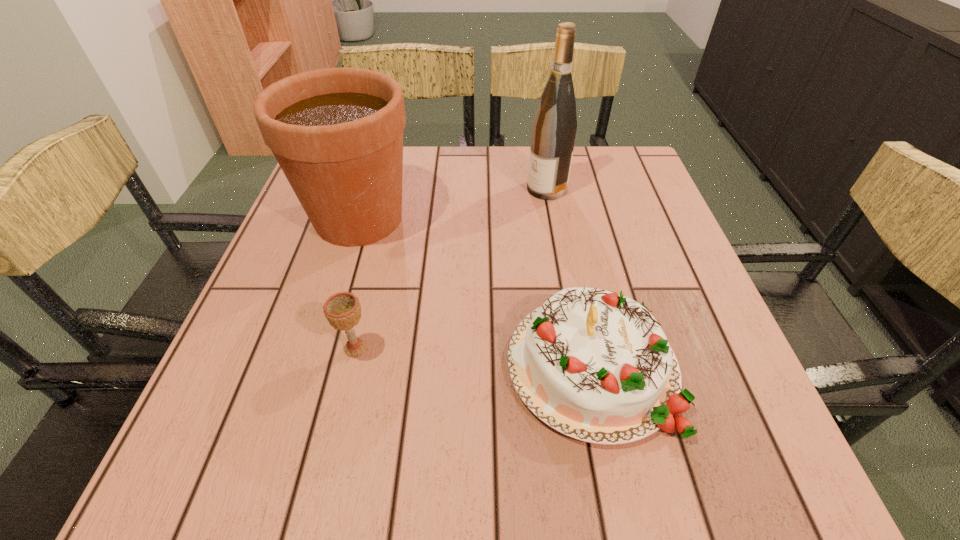
Image resolution: width=960 pixels, height=540 pixels. I want to click on object located in the near edge section of the desktop, so click(x=595, y=365).

The image size is (960, 540). What are the coordinates of `object that is at the left edge` in the screenshot? It's located at (337, 133).

The height and width of the screenshot is (540, 960). Find the location of `object that is at the right edge`. object that is at the right edge is located at coordinates (595, 365).

The image size is (960, 540). In order to click on object that is positioned at the far left corner in this screenshot , I will do `click(337, 133)`.

Image resolution: width=960 pixels, height=540 pixels. What are the coordinates of `object located in the near right corner section of the desktop` in the screenshot? It's located at (595, 365).

Where is `vacant space at the far edge of the desktop`? Image resolution: width=960 pixels, height=540 pixels. vacant space at the far edge of the desktop is located at coordinates (413, 159).

In the image, there is a desktop. Where is `vacant space at the near edge`? vacant space at the near edge is located at coordinates (348, 437).

In the image, there is a desktop. Where is `vacant space at the left edge`? vacant space at the left edge is located at coordinates (322, 294).

Locate an element on the screen. This screenshot has width=960, height=540. vacant area at the right edge is located at coordinates (694, 336).

Locate an element on the screen. This screenshot has width=960, height=540. vacant space at the near left corner is located at coordinates (269, 472).